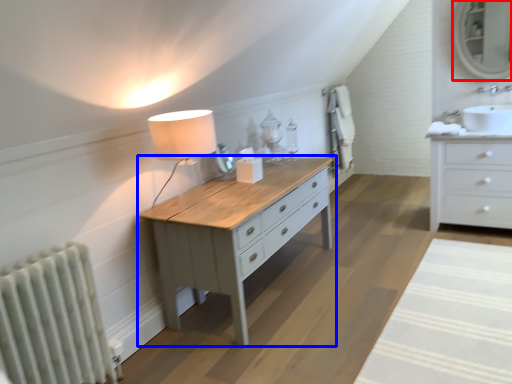
Question: Which of the following is the farthest to the observer, mirror (highlighted by a red box) or table (highlighted by a blue box)?

Choices:
 (A) mirror
 (B) table

Answer: (A)